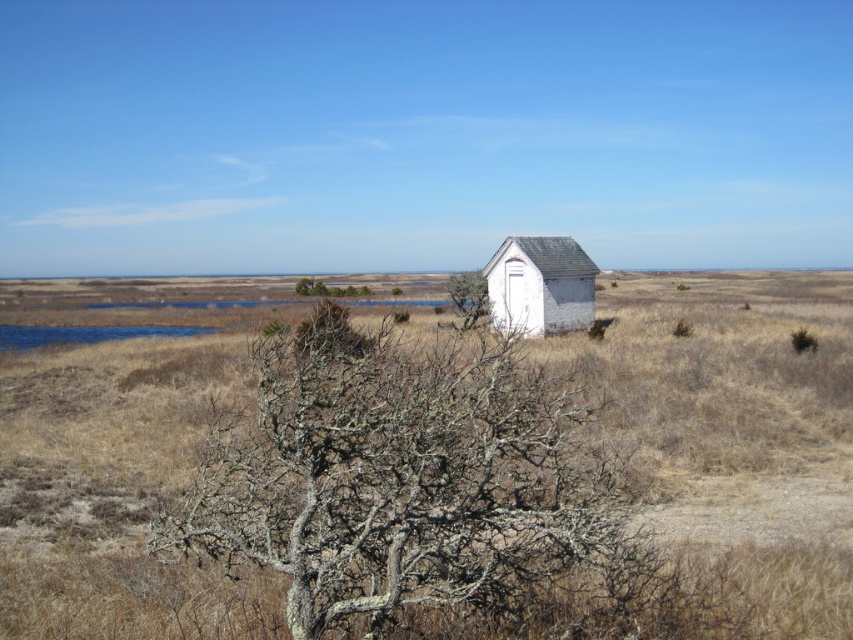
Based on the photo, does gray lichen-covered tree at center have a lesser width compared to white wood hut at center?

No, gray lichen-covered tree at center is not thinner than white wood hut at center.

At what (x,y) coordinates should I click in order to perform the action: click on gray lichen-covered tree at center. Please return your answer as a coordinate pair (x, y). The image size is (853, 640). Looking at the image, I should click on (405, 481).

Consider the image. Does gray lichen-covered tree at center appear on the right side of green mossy tree at center?

Incorrect, gray lichen-covered tree at center is not on the right side of green mossy tree at center.

Measure the distance between gray lichen-covered tree at center and camera.

They are 4.98 meters apart.

The image size is (853, 640). I want to click on gray lichen-covered tree at center, so click(x=405, y=481).

Find the location of `white wood hut at center`. white wood hut at center is located at coordinates (540, 285).

Which is more to the left, white wood hut at center or green mossy tree at center?

From the viewer's perspective, green mossy tree at center appears more on the left side.

Does point (490, 307) come farther from viewer compared to point (486, 285)?

No, (490, 307) is closer to viewer.

Image resolution: width=853 pixels, height=640 pixels. Identify the location of white wood hut at center. click(540, 285).